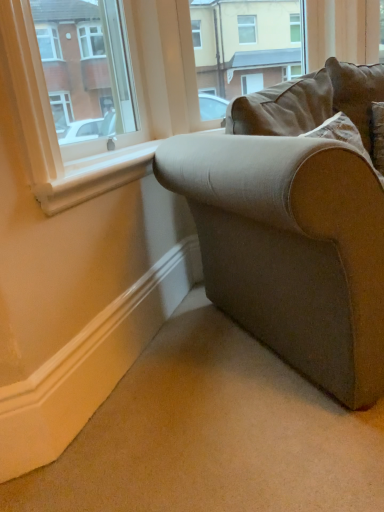
Question: Considering the relative positions of matte white window at upper left and brown fabric couch at upper right in the image provided, is matte white window at upper left to the left or to the right of brown fabric couch at upper right?

Choices:
 (A) right
 (B) left

Answer: (B)

Question: Is matte white window at upper left taller or shorter than brown fabric couch at upper right?

Choices:
 (A) short
 (B) tall

Answer: (A)

Question: Which object is the closest to the white painted wood at lower left?

Choices:
 (A) brown fabric couch at upper right
 (B) matte white window at upper left
 (C) textured beige couch at lower right

Answer: (B)

Question: Which object is the farthest from the matte white window at upper left?

Choices:
 (A) white painted wood at lower left
 (B) brown fabric couch at upper right
 (C) textured beige couch at lower right

Answer: (B)